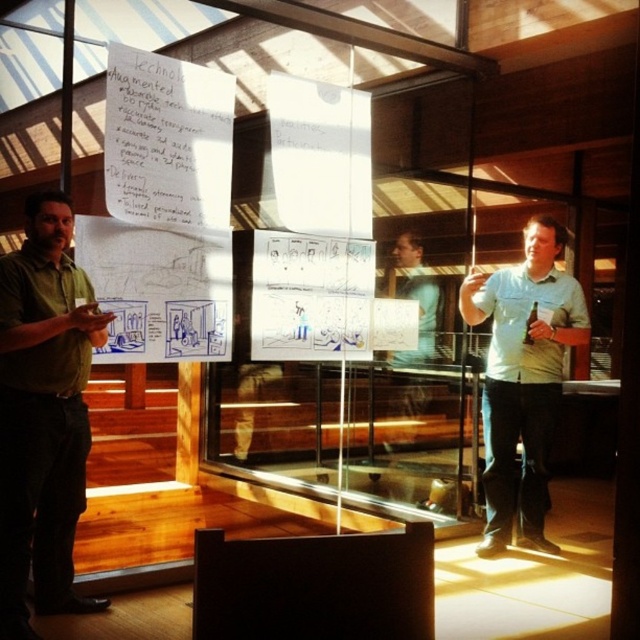
You are attending a meeting and need to decide which person to approach for a quick question. The green matte shirt at left and the white shirt at right are both present. Which person is more likely to be approachable based on their posture? Please consider their clothing descriptions and the spatial context provided.

The green matte shirt at left is thinner than the white shirt at right, so the person wearing the green matte shirt at left may have a posture that appears more approachable due to their slimmer figure.

You are a photographer standing behind the podium at the bottom edge of the frame. You want to take a photo of both the green matte shirt at left and the white shirt at right in the same shot. Given that your camera has a maximum focus range of 2 meters, will both subjects be in focus?

The distance between the green matte shirt at left and white shirt at right is 2.31 meters, which exceeds the camera maximum focus range of 2 meters. Therefore, both subjects cannot be in focus simultaneously.